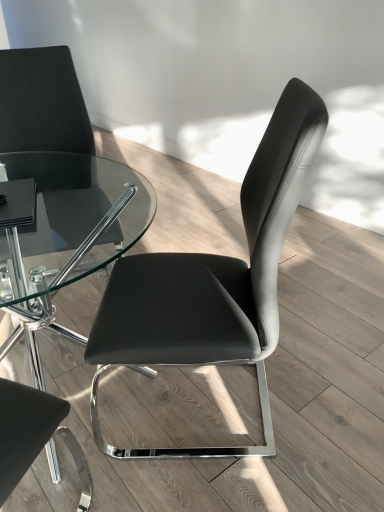
Question: Is point (256, 185) positioned closer to the camera than point (56, 64)?

Choices:
 (A) farther
 (B) closer

Answer: (B)

Question: Looking at the image, does black leather chair at center, which is the 2th chair from left to right, seem bigger or smaller compared to black leather chair at upper left, the first chair in the left-to-right sequence?

Choices:
 (A) big
 (B) small

Answer: (B)

Question: Is black leather chair at center, the first chair viewed from the right, to the left or to the right of black leather chair at upper left, which ranks as the second chair in right-to-left order, in the image?

Choices:
 (A) left
 (B) right

Answer: (B)

Question: Does point (94, 227) appear closer or farther from the camera than point (127, 354)?

Choices:
 (A) farther
 (B) closer

Answer: (A)

Question: Would you say black leather chair at upper left, which ranks as the second chair in right-to-left order, is to the left or to the right of black leather chair at center, which is the 2th chair from left to right, in the picture?

Choices:
 (A) left
 (B) right

Answer: (A)

Question: In terms of size, does black leather chair at upper left, which ranks as the second chair in right-to-left order, appear bigger or smaller than black leather chair at center, which is the 2th chair from left to right?

Choices:
 (A) small
 (B) big

Answer: (B)

Question: From the image's perspective, is black leather chair at upper left, which ranks as the second chair in right-to-left order, above or below black leather chair at center, which is the 2th chair from left to right?

Choices:
 (A) above
 (B) below

Answer: (A)